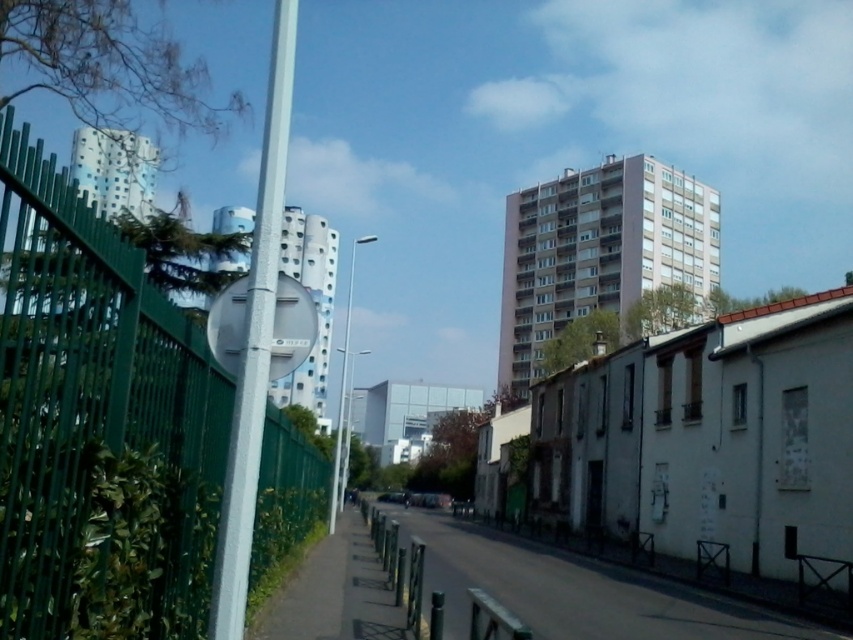
Can you confirm if metallic pole at left is positioned above metallic pole at center?

Indeed, metallic pole at left is positioned over metallic pole at center.

Looking at this image, does metallic pole at left appear on the right side of metallic pole at center?

Yes, metallic pole at left is to the right of metallic pole at center.

Is point (271, 164) farther from camera compared to point (363, 237)?

No, (271, 164) is closer to viewer.

The width and height of the screenshot is (853, 640). What are the coordinates of `metallic pole at left` in the screenshot? It's located at (254, 344).

Describe the element at coordinates (91, 397) in the screenshot. This screenshot has height=640, width=853. I see `green metal fence at left` at that location.

Between green metal fence at left and metallic pole at center, which one appears on the left side from the viewer's perspective?

Positioned to the left is metallic pole at center.

Which is in front, point (135, 289) or point (341, 387)?

Point (135, 289) is in front.

Find the location of `green metal fence at left`. green metal fence at left is located at coordinates (91, 397).

Locate an element on the screen. smooth concrete alley at center is located at coordinates (576, 589).

Between smooth concrete alley at center and white metallic sign at center-left, which one appears on the left side from the viewer's perspective?

Positioned to the left is white metallic sign at center-left.

Measure the distance between smooth concrete alley at center and camera.

The distance of smooth concrete alley at center from camera is 22.32 feet.

Where is `smooth concrete alley at center`? smooth concrete alley at center is located at coordinates (576, 589).